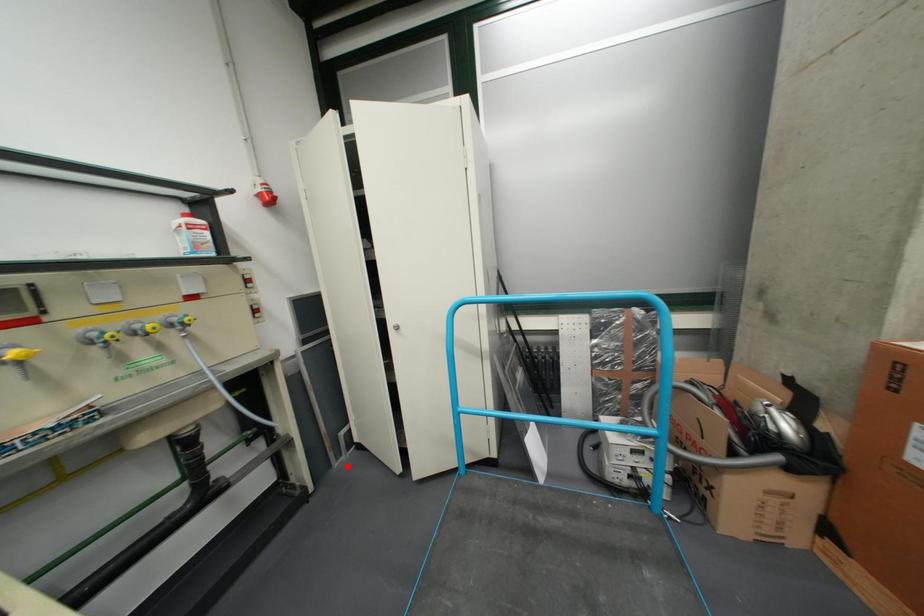
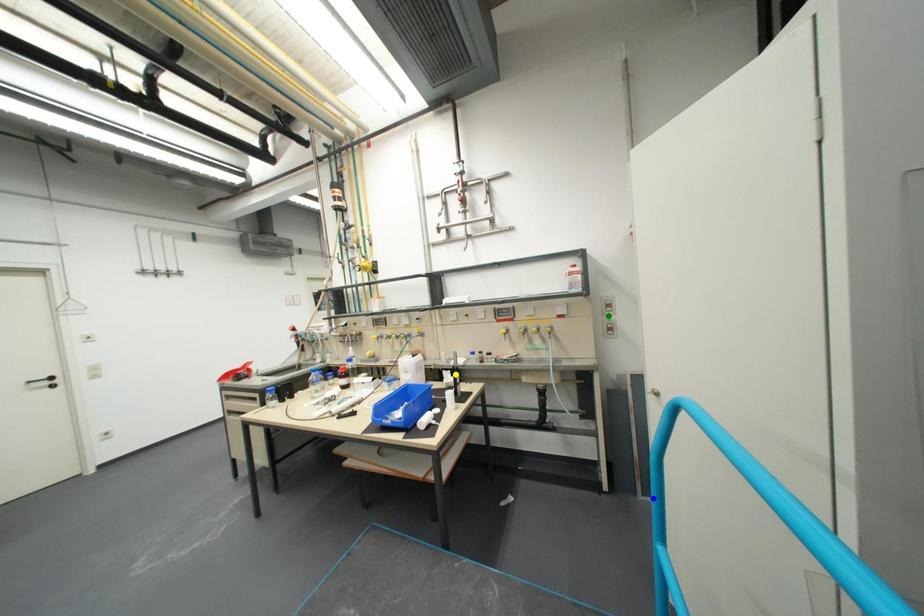
Question: I am providing you with two images of the same scene from different viewpoints. A red point is marked on the first image. You are given multiple points on the second image. Which mark in image 2 goes with the point in image 1?

Choices:
 (A) yellow point
 (B) green point
 (C) blue point

Answer: (C)